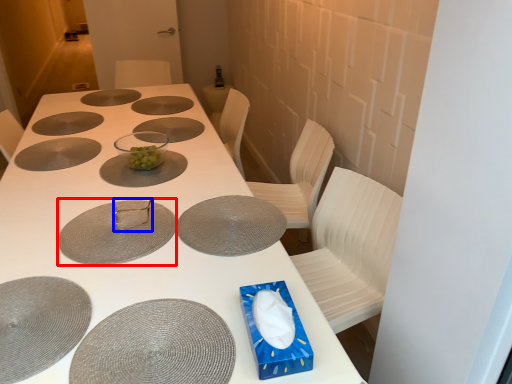
Question: Which of the following is the closest to the observer, glass plate (highlighted by a red box) or tableware (highlighted by a blue box)?

Choices:
 (A) glass plate
 (B) tableware

Answer: (A)